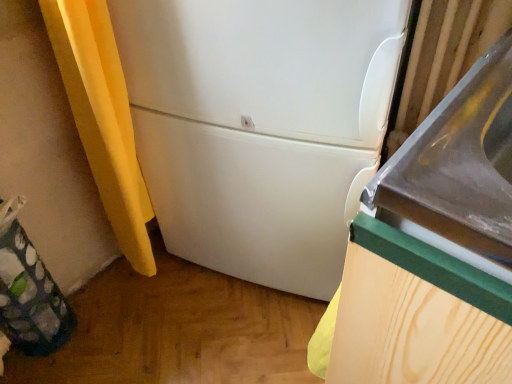
Question: From a real-world perspective, is green fabric bag at lower left physically located above or below white glossy sink at center right?

Choices:
 (A) below
 (B) above

Answer: (A)

Question: Is point (10, 205) closer or farther from the camera than point (500, 57)?

Choices:
 (A) closer
 (B) farther

Answer: (B)

Question: Which object is the farthest from the white matte refrigerator at center?

Choices:
 (A) green fabric bag at lower left
 (B) white glossy sink at center right

Answer: (A)

Question: Estimate the real-world distances between objects in this image. Which object is closer to the white glossy sink at center right?

Choices:
 (A) white matte refrigerator at center
 (B) green fabric bag at lower left

Answer: (A)